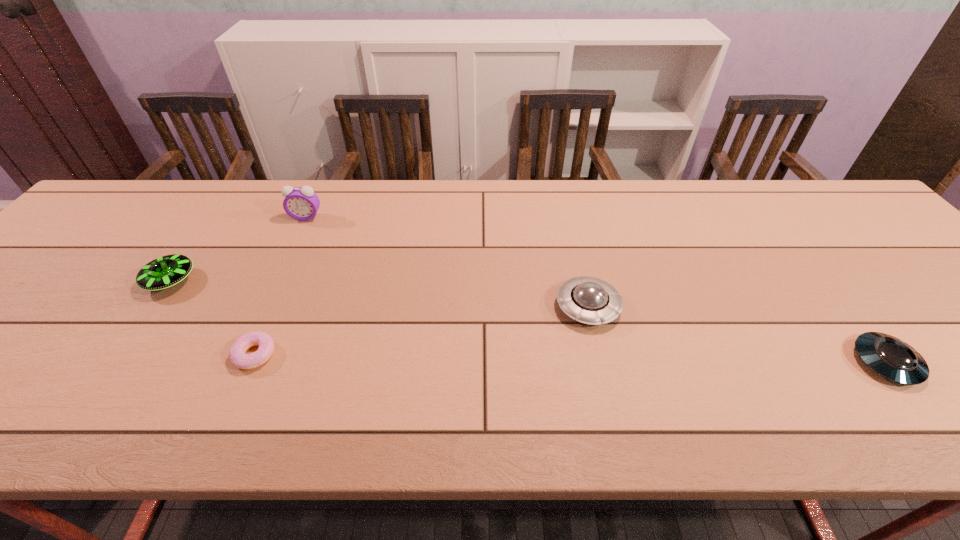
The width and height of the screenshot is (960, 540). Identify the location of the tallest object. (301, 203).

The width and height of the screenshot is (960, 540). What are the coordinates of `the farthest object` in the screenshot? It's located at (301, 203).

In order to click on the second saucer from right to left in this screenshot , I will do `click(589, 300)`.

Find the location of a particular element. Image resolution: width=960 pixels, height=540 pixels. the leftmost saucer is located at coordinates (167, 271).

Where is `the shortest saucer`? the shortest saucer is located at coordinates (888, 356).

Where is `the fourth tallest object`? This screenshot has width=960, height=540. the fourth tallest object is located at coordinates coord(888,356).

Where is `doughnut`? This screenshot has height=540, width=960. doughnut is located at coordinates (238, 357).

At what (x,y) coordinates should I click in order to perform the action: click on vacant area situated 0.110m on the face of the farthest object. Please return your answer as a coordinate pair (x, y). Image resolution: width=960 pixels, height=540 pixels. Looking at the image, I should click on (292, 247).

You are a GUI agent. You are given a task and a screenshot of the screen. Output one action in this format:
    pyautogui.click(x=<x>, y=<y>)
    Task: Click on the vacant space located on the left of the second saucer from right to left
    
    Given the screenshot: What is the action you would take?
    pyautogui.click(x=434, y=307)

Identify the location of vacant point located on the right of the leftmost saucer. The image size is (960, 540). (262, 281).